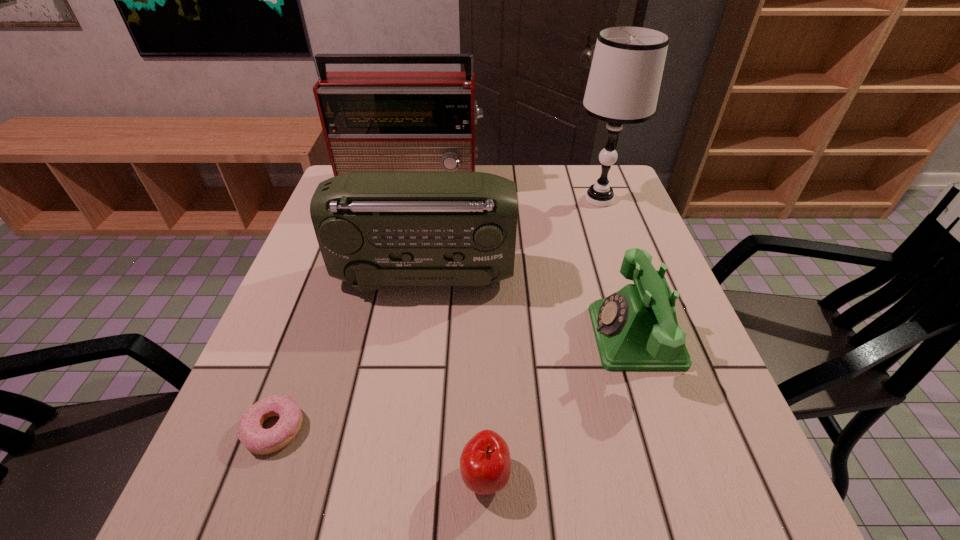
Identify the location of free space located on the front-facing side of the nearer radio_receiver. (627, 276).

Locate an element on the screen. The image size is (960, 540). free space located 0.380m on the dial of the telephone is located at coordinates (406, 337).

The width and height of the screenshot is (960, 540). I want to click on free space located on the dial of the telephone, so click(x=535, y=337).

Find the location of a particular element. The image size is (960, 540). free space located 0.270m on the dial of the telephone is located at coordinates (461, 337).

Where is `blank space located 0.140m on the left of the apple`? blank space located 0.140m on the left of the apple is located at coordinates (372, 476).

This screenshot has width=960, height=540. Find the location of `free spot located 0.390m on the right of the doughnut`. free spot located 0.390m on the right of the doughnut is located at coordinates (533, 429).

This screenshot has height=540, width=960. I want to click on table lamp situated at the far edge, so click(624, 81).

The image size is (960, 540). In order to click on radio receiver present at the far edge in this screenshot , I will do `click(372, 121)`.

Locate an element on the screen. object that is at the near edge is located at coordinates (485, 463).

This screenshot has height=540, width=960. Identify the location of doughnut that is at the left edge. (257, 440).